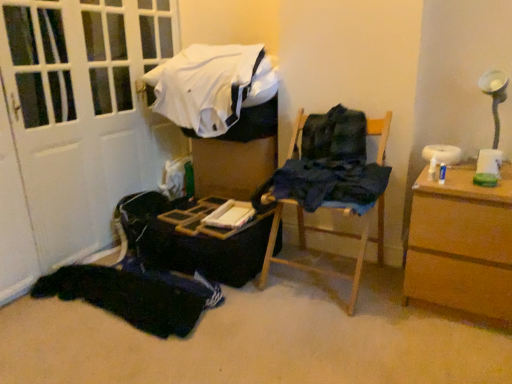
The width and height of the screenshot is (512, 384). What are the coordinates of `free space to the left of brown wooden chest of drawers at right` in the screenshot? It's located at (377, 311).